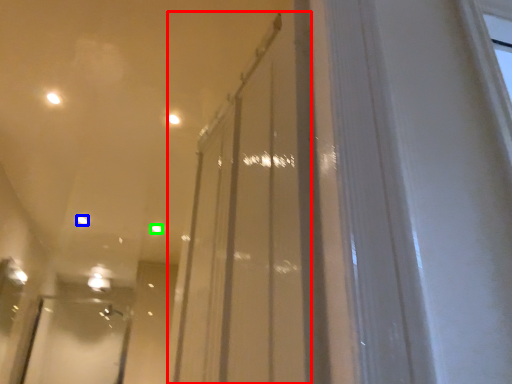
Question: Estimate the real-world distances between objects in this image. Which object is closer to glass door (highlighted by a red box), light (highlighted by a blue box) or light (highlighted by a green box)?

Choices:
 (A) light
 (B) light

Answer: (B)